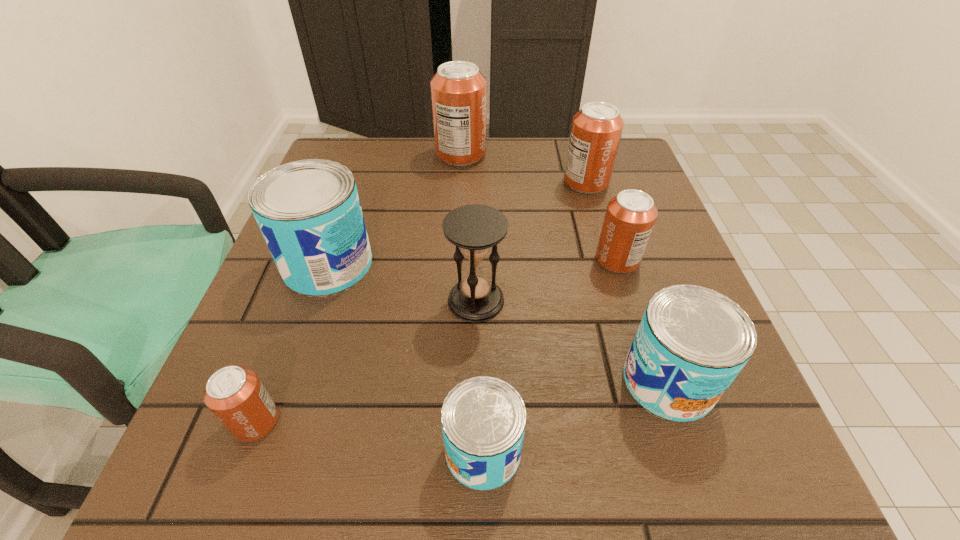
Find the location of a particular element. the second orange can from left to right is located at coordinates (458, 89).

Locate an element on the screen. Image resolution: width=960 pixels, height=540 pixels. the tallest object is located at coordinates (458, 89).

The width and height of the screenshot is (960, 540). What are the coordinates of `the second farthest object` in the screenshot? It's located at (596, 130).

Find the location of `the second biggest orange can`. the second biggest orange can is located at coordinates (596, 130).

Identify the location of the biggest blue can. The width and height of the screenshot is (960, 540). (309, 212).

Identify the location of the leftmost blue can. The image size is (960, 540). (309, 212).

Find the location of a particular element. The height and width of the screenshot is (540, 960). hourglass is located at coordinates tap(475, 229).

Find the location of a particular element. The width and height of the screenshot is (960, 540). the third farthest orange can is located at coordinates coord(630,216).

I want to click on the second biggest blue can, so click(692, 342).

Identify the location of the smallest orange can. The height and width of the screenshot is (540, 960). (235, 395).